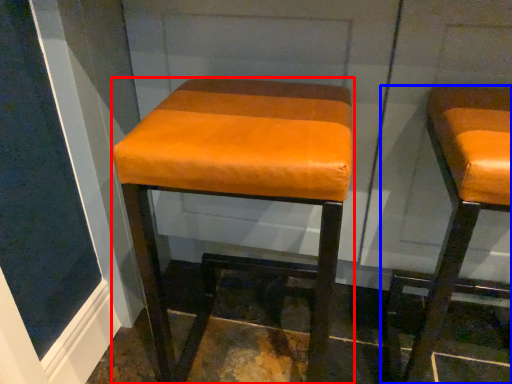
Question: Which of the following is the farthest to the observer, stool (highlighted by a red box) or stool (highlighted by a blue box)?

Choices:
 (A) stool
 (B) stool

Answer: (A)